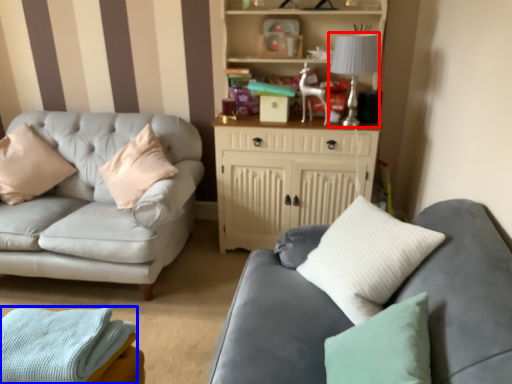
Question: Which object is further to the camera taking this photo, lamp (highlighted by a red box) or material (highlighted by a blue box)?

Choices:
 (A) lamp
 (B) material

Answer: (A)